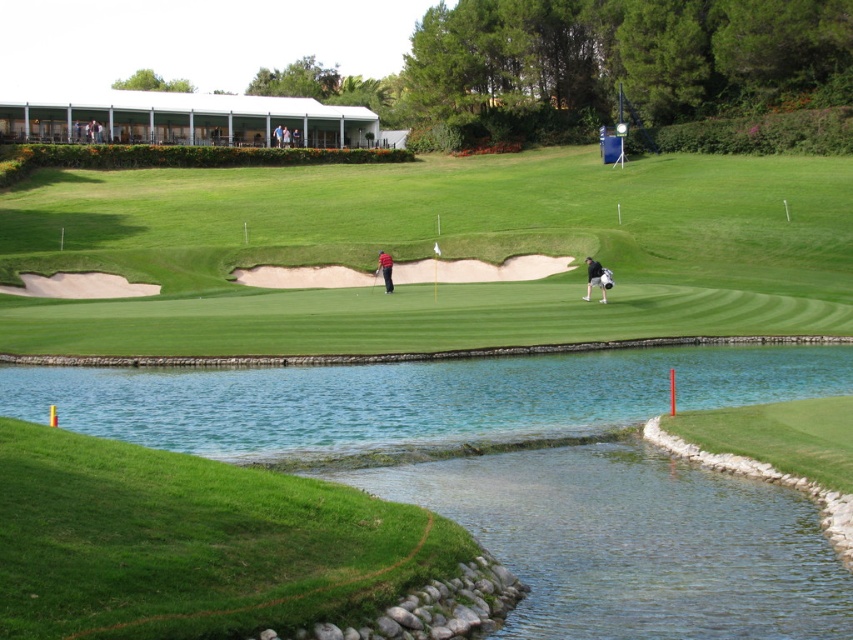
Between green grassy golf course at center and red matte golf club at center, which one has more height?

green grassy golf course at center is taller.

Is point (645, 230) in front of point (387, 264)?

That is False.

This screenshot has width=853, height=640. In order to click on green grassy golf course at center in this screenshot , I will do `click(426, 250)`.

Is point (386, 268) in front of point (376, 273)?

Yes, point (386, 268) is in front of point (376, 273).

Who is shorter, red matte golf club at center or glossy wood golf club at center?

glossy wood golf club at center

Where is `red matte golf club at center`? The image size is (853, 640). red matte golf club at center is located at coordinates (386, 269).

Which is more to the left, black fabric golf bag at center or red matte golf club at center?

Positioned to the left is red matte golf club at center.

Does black fabric golf bag at center appear on the right side of red matte golf club at center?

Indeed, black fabric golf bag at center is positioned on the right side of red matte golf club at center.

Which is in front, point (589, 275) or point (386, 276)?

Point (589, 275)

Image resolution: width=853 pixels, height=640 pixels. I want to click on black fabric golf bag at center, so click(x=595, y=278).